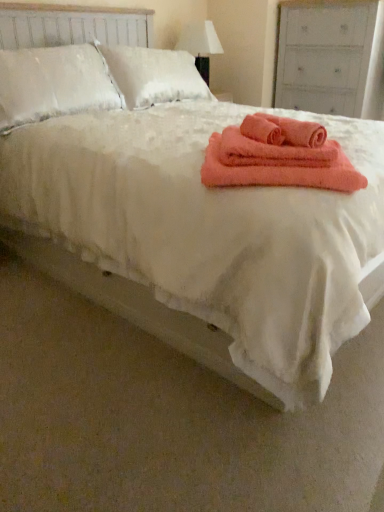
Question: Is coral soft towel at center surrounding white fabric lampshade at upper center?

Choices:
 (A) no
 (B) yes

Answer: (A)

Question: From a real-world perspective, does coral soft towel at center sit lower than white fabric lampshade at upper center?

Choices:
 (A) no
 (B) yes

Answer: (B)

Question: From the image's perspective, is coral soft towel at center beneath white fabric lampshade at upper center?

Choices:
 (A) yes
 (B) no

Answer: (A)

Question: Is coral soft towel at center positioned in front of white fabric lampshade at upper center?

Choices:
 (A) yes
 (B) no

Answer: (A)

Question: From a real-world perspective, is coral soft towel at center on white fabric lampshade at upper center?

Choices:
 (A) no
 (B) yes

Answer: (A)

Question: From the image's perspective, is coral fuzzy bath towel at center, acting as the 1th bath towel starting from the right, positioned above or below white fabric lampshade at upper center?

Choices:
 (A) below
 (B) above

Answer: (A)

Question: Considering the positions of coral fuzzy bath towel at center, acting as the 1th bath towel starting from the right, and white fabric lampshade at upper center in the image, is coral fuzzy bath towel at center, acting as the 1th bath towel starting from the right, taller or shorter than white fabric lampshade at upper center?

Choices:
 (A) short
 (B) tall

Answer: (A)

Question: Is coral fuzzy bath towel at center, acting as the 1th bath towel starting from the right, wider or thinner than white fabric lampshade at upper center?

Choices:
 (A) thin
 (B) wide

Answer: (A)

Question: Considering the positions of coral fuzzy bath towel at center, the 3th bath towel when ordered from left to right, and white fabric lampshade at upper center in the image, is coral fuzzy bath towel at center, the 3th bath towel when ordered from left to right, bigger or smaller than white fabric lampshade at upper center?

Choices:
 (A) small
 (B) big

Answer: (A)

Question: From a real-world perspective, is coral soft towel at center positioned above or below coral soft towel at center, placed as the 1th bath towel when sorted from left to right?

Choices:
 (A) below
 (B) above

Answer: (A)

Question: From the image's perspective, is coral soft towel at center located above or below coral soft towel at center, positioned as the 3th bath towel in right-to-left order?

Choices:
 (A) above
 (B) below

Answer: (B)

Question: In the image, is coral soft towel at center positioned in front of or behind coral soft towel at center, placed as the 1th bath towel when sorted from left to right?

Choices:
 (A) front
 (B) behind

Answer: (A)

Question: Considering the positions of point (x=324, y=178) and point (x=278, y=130), is point (x=324, y=178) closer or farther from the camera than point (x=278, y=130)?

Choices:
 (A) closer
 (B) farther

Answer: (A)

Question: Based on their positions, is coral soft towel at center located to the left or right of white fabric lampshade at upper center?

Choices:
 (A) left
 (B) right

Answer: (B)

Question: Is coral soft towel at center inside the boundaries of white fabric lampshade at upper center, or outside?

Choices:
 (A) outside
 (B) inside

Answer: (A)